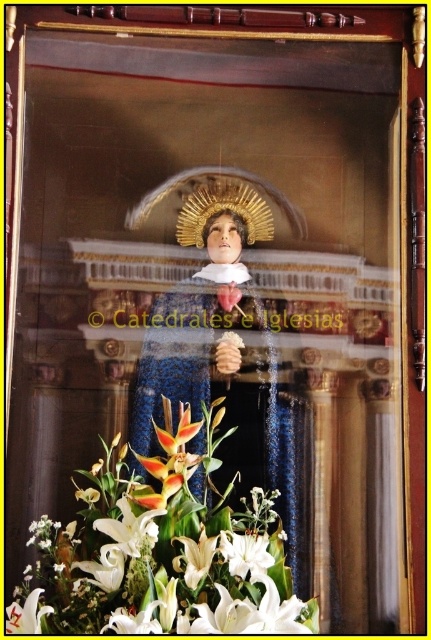
You are an interior designer planning to place a tall decorative vase next to the religious icon. The vase is 1.2 meters tall. You see the white lilies at lower center and the white lily at lower center in the scene. Which one is taller and should you consider its height when placing the vase?

The white lilies at lower center is taller than the white lily at lower center. Since the vase is 1.2 meters tall, you should consider the height of the white lilies at lower center to ensure proper spacing and visual balance.

You are an art conservator examining the religious icon. You notice two white lilies at the base of the statue. Which one, the white lilies at lower center or the white lily at lower center, is closer to you?

The white lilies at lower center is closer to you as it is in front of the white lily at lower center.